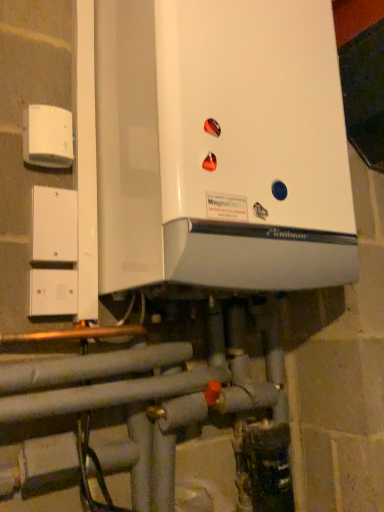
Identify the location of white plastic/light switch at left. This screenshot has height=512, width=384. (53, 225).

From the image's perspective, is white plastic electric outlet at upper left below white glossy boiler at center?

Indeed, from the image's perspective, white plastic electric outlet at upper left is shown beneath white glossy boiler at center.

Can you tell me how much white plastic electric outlet at upper left and white glossy boiler at center differ in facing direction?

6.29 degrees separate the facing orientations of white plastic electric outlet at upper left and white glossy boiler at center.

Which is in front, point (66, 159) or point (293, 194)?

The point (293, 194) is more forward.

From a real-world perspective, which is physically below, white plastic electric outlet at upper left or white glossy boiler at center?

From a 3D spatial view, white plastic electric outlet at upper left is below.

Does white glossy boiler at center turn towards white plastic electric outlet at upper left?

No, white glossy boiler at center is not aimed at white plastic electric outlet at upper left.

At what (x,y) coordinates should I click in order to perform the action: click on electric outlet below the white glossy boiler at center (from a real-world perspective). Please return your answer as a coordinate pair (x, y). Looking at the image, I should click on (47, 136).

Is white plastic electric outlet at upper left surrounded by white glossy boiler at center?

No, white plastic electric outlet at upper left is not surrounded by white glossy boiler at center.

Is white glossy boiler at center with white plastic electric outlet at upper left?

No, white glossy boiler at center is not with white plastic electric outlet at upper left.

From the image's perspective, is white plastic/light switch at left below white glossy boiler at center?

Correct, white plastic/light switch at left appears lower than white glossy boiler at center in the image.

At what (x,y) coordinates should I click in order to perform the action: click on home appliance located in front of the white plastic/light switch at left. Please return your answer as a coordinate pair (x, y). This screenshot has height=512, width=384. Looking at the image, I should click on (221, 145).

In terms of size, does white plastic/light switch at left appear bigger or smaller than white glossy boiler at center?

Considering their sizes, white plastic/light switch at left takes up less space than white glossy boiler at center.

Is the surface of white plastic/light switch at left in direct contact with white glossy boiler at center?

white plastic/light switch at left and white glossy boiler at center are not in contact.

Is white plastic electric outlet at upper left oriented towards white plastic/light switch at left?

No, white plastic electric outlet at upper left is not facing towards white plastic/light switch at left.

How many degrees apart are the facing directions of white plastic electric outlet at upper left and white plastic/light switch at left?

0.467 degrees separate the facing orientations of white plastic electric outlet at upper left and white plastic/light switch at left.

How distant is white plastic electric outlet at upper left from white plastic/light switch at left?

white plastic electric outlet at upper left and white plastic/light switch at left are 4.44 inches apart from each other.

Between white plastic electric outlet at upper left and white plastic/light switch at left, which one appears on the left side from the viewer's perspective?

Positioned to the left is white plastic electric outlet at upper left.

Is white glossy boiler at center situated inside white plastic/light switch at left or outside?

white glossy boiler at center cannot be found inside white plastic/light switch at left.

What's the angular difference between white glossy boiler at center and white plastic/light switch at left's facing directions?

white glossy boiler at center and white plastic/light switch at left are facing 5.82 degrees away from each other.

Identify the location of home appliance on the right of white plastic/light switch at left. The height and width of the screenshot is (512, 384). (221, 145).

From a real-world perspective, who is located lower, white plastic/light switch at left or white plastic electric outlet at upper left?

white plastic/light switch at left is physically lower.

Based on the photo, are white plastic/light switch at left and white plastic electric outlet at upper left beside each other?

No, white plastic/light switch at left is not beside white plastic electric outlet at upper left.

From the image's perspective, which object appears higher, white plastic/light switch at left or white plastic electric outlet at upper left?

Result: white plastic electric outlet at upper left.

Where is `electric outlet that appears above the white plastic/light switch at left (from a real-world perspective)`? This screenshot has width=384, height=512. electric outlet that appears above the white plastic/light switch at left (from a real-world perspective) is located at coordinates (47, 136).

Identify the location of electric outlet lying below the white glossy boiler at center (from the image's perspective). (47, 136).

The width and height of the screenshot is (384, 512). Identify the location of electric outlet on the left side of white glossy boiler at center. (47, 136).

From the image, which object appears to be farther from white plastic electric outlet at upper left, white plastic/light switch at left or white glossy boiler at center?

Among the two, white glossy boiler at center is located further to white plastic electric outlet at upper left.

Considering their positions, is white plastic electric outlet at upper left positioned closer to white plastic/light switch at left than white glossy boiler at center?

white plastic electric outlet at upper left is positioned closer to the anchor white plastic/light switch at left.

Based on their spatial positions, is white plastic/light switch at left or white plastic electric outlet at upper left further from white glossy boiler at center?

Among the two, white plastic/light switch at left is located further to white glossy boiler at center.

From the picture: Based on their spatial positions, is white glossy boiler at center or white plastic electric outlet at upper left closer to white plastic/light switch at left?

white plastic electric outlet at upper left is closer to white plastic/light switch at left.

Estimate the real-world distances between objects in this image. Which object is closer to white glossy boiler at center, white plastic electric outlet at upper left or white plastic/light switch at left?

Based on the image, white plastic electric outlet at upper left appears to be nearer to white glossy boiler at center.

Based on their spatial positions, is white glossy boiler at center or white plastic/light switch at left closer to white plastic electric outlet at upper left?

white plastic/light switch at left is closer to white plastic electric outlet at upper left.

Identify the location of light switch between white plastic electric outlet at upper left and white glossy boiler at center. (53, 225).